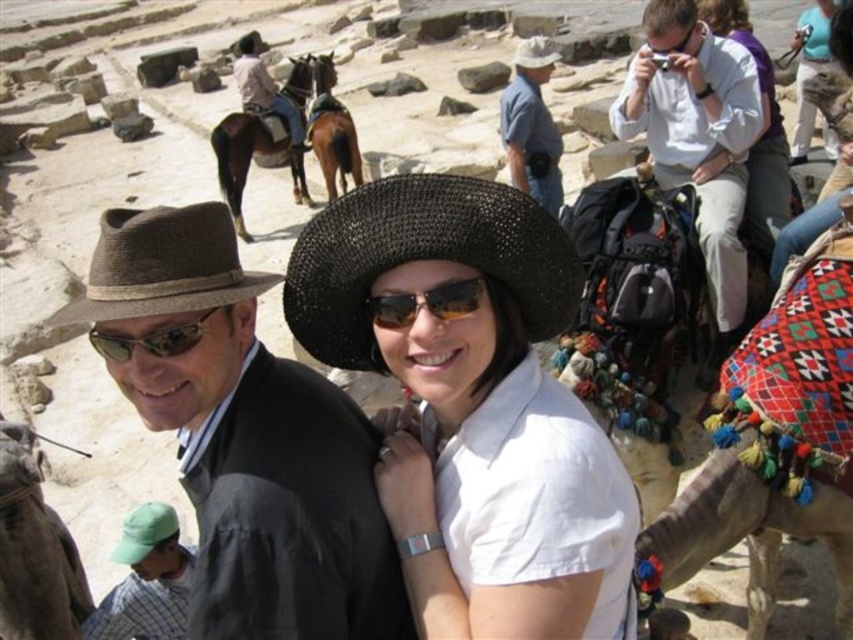
Who is shorter, white cotton shirt at upper right or brown leather horse at upper center?

Standing shorter between the two is white cotton shirt at upper right.

Which is behind, point (723, 163) or point (258, 122)?

Point (258, 122)

Which is in front, point (711, 156) or point (236, 182)?

Point (711, 156) is more forward.

You are a GUI agent. You are given a task and a screenshot of the screen. Output one action in this format:
    pyautogui.click(x=<x>, y=<y>)
    Task: Click on the white cotton shirt at upper right
    
    Given the screenshot: What is the action you would take?
    pyautogui.click(x=697, y=136)

Who is taller, white cotton shirt at upper right or light blue denim jeans at upper right?

light blue denim jeans at upper right is taller.

Find the location of `white cotton shirt at upper right`. white cotton shirt at upper right is located at coordinates (697, 136).

Is brown leather horse at upper center above light blue denim jeans at upper right?

Incorrect, brown leather horse at upper center is not positioned above light blue denim jeans at upper right.

I want to click on brown leather horse at upper center, so click(251, 157).